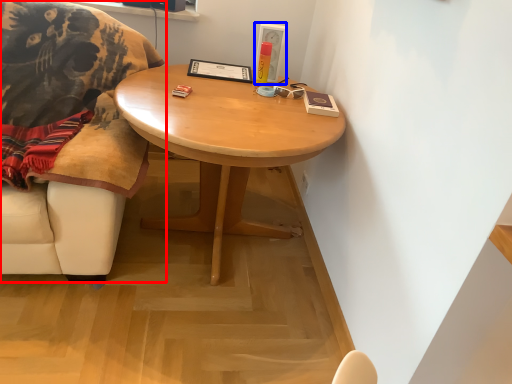
Question: Which of the following is the farthest to the observer, chair (highlighted by a red box) or picture frame (highlighted by a blue box)?

Choices:
 (A) chair
 (B) picture frame

Answer: (B)